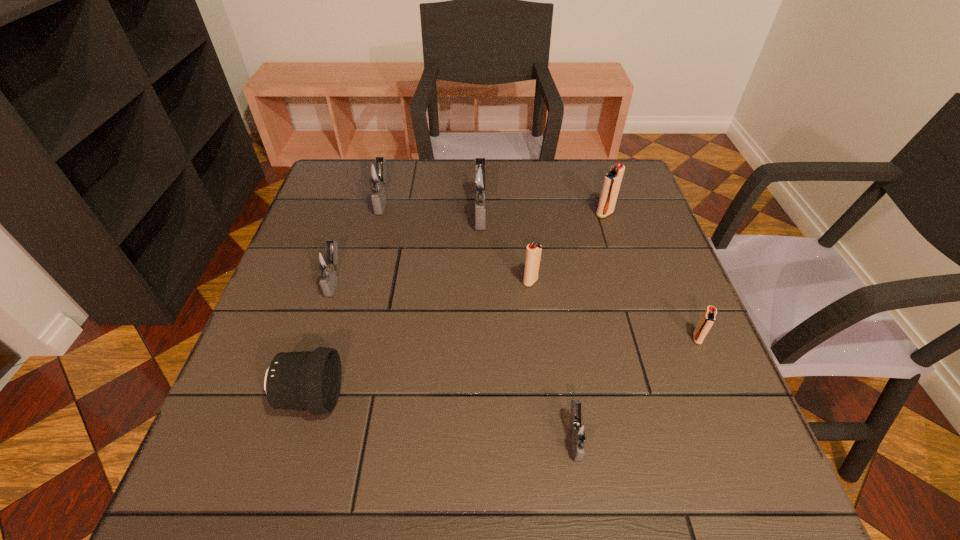
In the image, there is a desktop. Where is `vacant space at the far right corner`? Image resolution: width=960 pixels, height=540 pixels. vacant space at the far right corner is located at coordinates (622, 159).

You are a GUI agent. You are given a task and a screenshot of the screen. Output one action in this format:
    pyautogui.click(x=<x>, y=<y>)
    Task: Click on the free space between the sixth farthest object and the fourth igniter from left to right
    
    Given the screenshot: What is the action you would take?
    pyautogui.click(x=614, y=310)

Where is `free space between the second gray igniter from right to left and the rightmost igniter`? The width and height of the screenshot is (960, 540). free space between the second gray igniter from right to left and the rightmost igniter is located at coordinates (589, 275).

This screenshot has height=540, width=960. What are the coordinates of `free point between the rightmost object and the black telephoto lens` in the screenshot? It's located at (504, 368).

At what (x,y) coordinates should I click in order to perform the action: click on empty space between the second biggest gray igniter and the sixth farthest object. Please return your answer as a coordinate pair (x, y). The height and width of the screenshot is (540, 960). Looking at the image, I should click on (540, 269).

Where is `free space between the telephoto lens and the nearest gray igniter`? The height and width of the screenshot is (540, 960). free space between the telephoto lens and the nearest gray igniter is located at coordinates (443, 417).

The height and width of the screenshot is (540, 960). In order to click on free space between the farthest red igniter and the nearest gray igniter in this screenshot , I will do tap(589, 326).

Image resolution: width=960 pixels, height=540 pixels. Find the location of `vacant area that lies between the fourth object from left to right and the rightmost igniter`. vacant area that lies between the fourth object from left to right and the rightmost igniter is located at coordinates (589, 275).

You are a GUI agent. You are given a task and a screenshot of the screen. Output one action in this format:
    pyautogui.click(x=<x>, y=<y>)
    Task: Click on the vacant space that's between the black telephoto lens and the rightmost red igniter
    The image size is (960, 540).
    Given the screenshot: What is the action you would take?
    pyautogui.click(x=504, y=368)

Identify the location of free spot between the black telephoto lens and the tallest object. (396, 305).